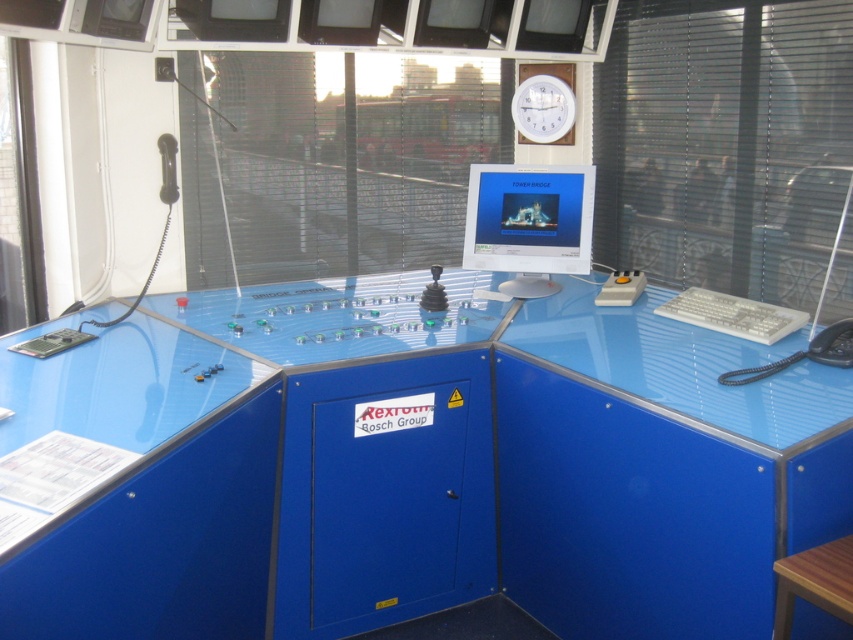
Based on the photo, does white glossy monitor at center appear over white plastic clock at upper center?

No, white glossy monitor at center is not above white plastic clock at upper center.

Between white glossy monitor at center and white plastic clock at upper center, which one is positioned higher?

white plastic clock at upper center is higher up.

Who is more forward, (527, 208) or (543, 74)?

Point (527, 208) is more forward.

Where is `white glossy monitor at center`? white glossy monitor at center is located at coordinates click(x=529, y=224).

Is glossy plastic computer desk at center behind wooden stool at lower right?

No, it is not.

The image size is (853, 640). What do you see at coordinates (424, 467) in the screenshot? I see `glossy plastic computer desk at center` at bounding box center [424, 467].

You are a GUI agent. You are given a task and a screenshot of the screen. Output one action in this format:
    pyautogui.click(x=<x>, y=<y>)
    Task: Click on the glossy plastic computer desk at center
    This screenshot has height=640, width=853.
    Given the screenshot: What is the action you would take?
    pyautogui.click(x=424, y=467)

Does glossy plastic computer desk at center appear under white plastic clock at upper center?

Indeed, glossy plastic computer desk at center is positioned under white plastic clock at upper center.

Who is more forward, (439, 321) or (560, 138)?

Point (439, 321) is more forward.

Is point (556, 337) positioned in front of point (560, 100)?

Yes.

The width and height of the screenshot is (853, 640). What are the coordinates of `glossy plastic computer desk at center` in the screenshot? It's located at (424, 467).